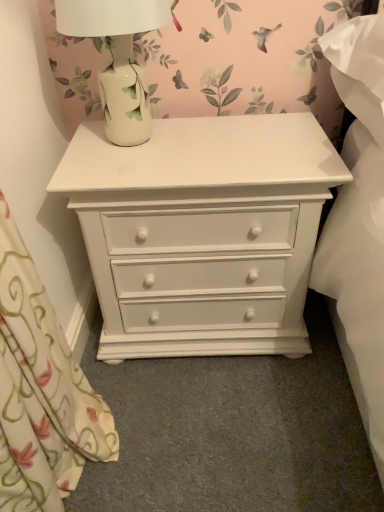
Locate an element on the screen. vacant location below white ceramic lamp at upper left (from a real-world perspective) is located at coordinates (141, 142).